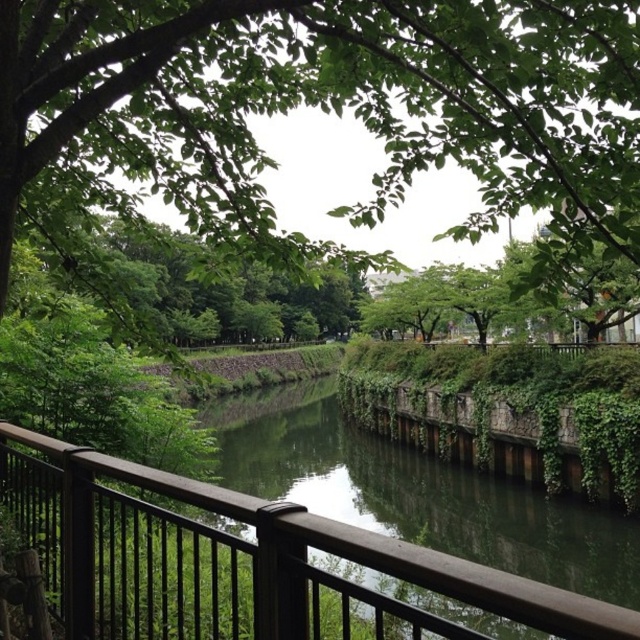
Between green leafy tree at upper center and brown wooden rail at lower left, which one appears on the right side from the viewer's perspective?

From the viewer's perspective, green leafy tree at upper center appears more on the right side.

Who is higher up, green leafy tree at upper center or brown wooden rail at lower left?

Result: green leafy tree at upper center

Does point (12, 61) lie in front of point (500, 586)?

No.

This screenshot has height=640, width=640. I want to click on green leafy tree at upper center, so click(330, 104).